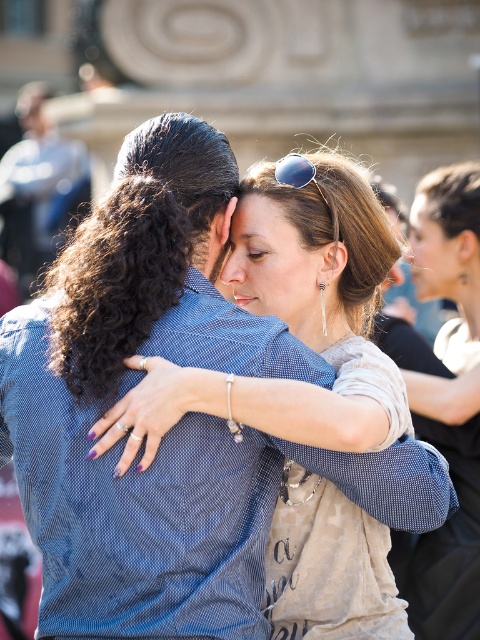
You are organizing items on a shelf and need to place the light beige fabric purse at center and the sunglasses at center. If the shelf has a width of 30 cm, can both items fit side by side without overlapping?

The light beige fabric purse at center might be wider than sunglasses at center, so it is uncertain if both items can fit side by side on a 30 cm shelf without overlapping. Measure the combined width of both items to confirm.

You are organizing a small bag in your hand. You see a light beige fabric purse at center and sunglasses at center. Which object is taller?

The light beige fabric purse at center is taller than the sunglasses at center.

You are a photographer adjusting your camera settings to focus on the matte blue shirt at center and the sunglasses at center. Which object should you focus on first to ensure proper depth of field?

The matte blue shirt at center is closer to the viewer than the sunglasses at center, so you should focus on the matte blue shirt at center first to ensure proper depth of field.